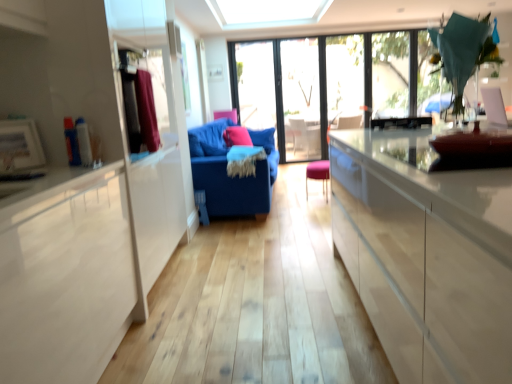
Question: Does point (326, 163) appear closer or farther from the camera than point (144, 112)?

Choices:
 (A) closer
 (B) farther

Answer: (B)

Question: Visually, is pink fabric stool at center positioned to the left or to the right of velvet maroon curtain at left?

Choices:
 (A) right
 (B) left

Answer: (A)

Question: Which of these objects is positioned closest to the transparent glass window at center, the second window in the right-to-left sequence?

Choices:
 (A) pink fabric stool at center
 (B) transparent glass screen door at center
 (C) matte pink pillow at center
 (D) velvet maroon curtain at left
 (E) blue fabric couch at center

Answer: (B)

Question: Which object is the farthest from the transparent glass window at center, the first window viewed from the left?

Choices:
 (A) transparent glass window at upper center, which is the 2th window in left-to-right order
 (B) velvet maroon curtain at left
 (C) pink fabric stool at center
 (D) matte pink pillow at center
 (E) blue fabric couch at center

Answer: (B)